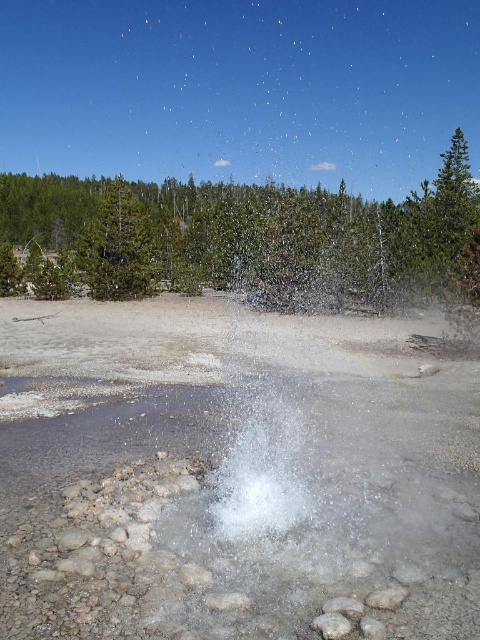
Question: Which point is closer to the camera?

Choices:
 (A) green matte tree at upper center
 (B) green leafy tree at upper center
 (C) clear water at center

Answer: (C)

Question: Which of the following is the farthest from the observer?

Choices:
 (A) click(181, 636)
 (B) click(347, 225)

Answer: (B)

Question: Is green leafy tree at upper center to the right of green matte tree at upper center from the viewer's perspective?

Choices:
 (A) no
 (B) yes

Answer: (B)

Question: Considering the real-world distances, which object is farthest from the green leafy tree at upper center?

Choices:
 (A) green matte tree at upper center
 (B) clear water at center

Answer: (B)

Question: In this image, where is clear water at center located relative to green leafy tree at upper center?

Choices:
 (A) left
 (B) right

Answer: (A)

Question: Observing the image, what is the correct spatial positioning of clear water at center in reference to green leafy tree at upper center?

Choices:
 (A) below
 (B) above

Answer: (A)